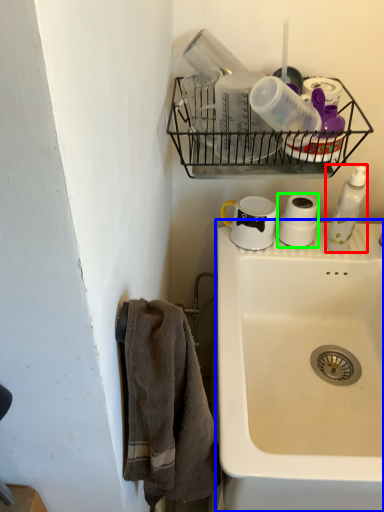
Question: Based on their relative distances, which object is nearer to soap dispenser (highlighted by a red box)? Choose from sink (highlighted by a blue box) and toilet paper (highlighted by a green box).

Choices:
 (A) sink
 (B) toilet paper

Answer: (B)